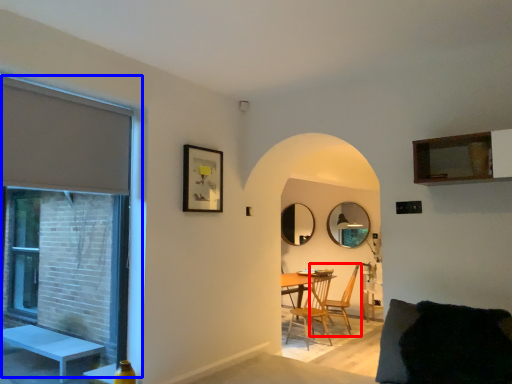
Question: Which object is closer to the camera taking this photo, chair (highlighted by a red box) or window (highlighted by a blue box)?

Choices:
 (A) chair
 (B) window

Answer: (B)